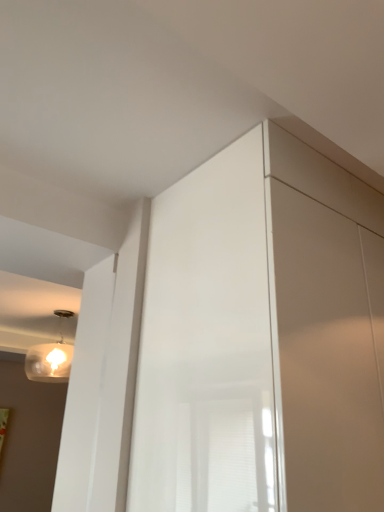
What do you see at coordinates (51, 357) in the screenshot? I see `matte glass lamp at upper left` at bounding box center [51, 357].

This screenshot has height=512, width=384. I want to click on matte glass lamp at upper left, so click(51, 357).

This screenshot has height=512, width=384. What do you see at coordinates (208, 347) in the screenshot? I see `glossy white screen door at center` at bounding box center [208, 347].

In order to click on glossy white screen door at center in this screenshot , I will do `click(208, 347)`.

Identify the location of matte glass lamp at upper left. Image resolution: width=384 pixels, height=512 pixels. (51, 357).

Considering the positions of objects glossy white screen door at center and matte glass lamp at upper left in the image provided, who is more to the right, glossy white screen door at center or matte glass lamp at upper left?

glossy white screen door at center.

Which object is closer to the camera taking this photo, glossy white screen door at center or matte glass lamp at upper left?

Positioned in front is glossy white screen door at center.

Is point (271, 468) closer or farther from the camera than point (50, 357)?

Point (271, 468) is positioned closer to the camera compared to point (50, 357).

From the image's perspective, between glossy white screen door at center and matte glass lamp at upper left, which one is located above?

glossy white screen door at center is shown above in the image.

Consider the image. From a real-world perspective, is glossy white screen door at center over matte glass lamp at upper left?

No, from a real-world perspective, glossy white screen door at center is not above matte glass lamp at upper left.

Is glossy white screen door at center wider than matte glass lamp at upper left?

Yes.

Does glossy white screen door at center have a lesser height compared to matte glass lamp at upper left?

No.

Looking at the image, does glossy white screen door at center seem bigger or smaller compared to matte glass lamp at upper left?

Considering their sizes, glossy white screen door at center takes up more space than matte glass lamp at upper left.

Is matte glass lamp at upper left surrounded by glossy white screen door at center?

No.

Is the surface of glossy white screen door at center in direct contact with matte glass lamp at upper left?

glossy white screen door at center is not next to matte glass lamp at upper left, and they're not touching.

Is glossy white screen door at center looking in the opposite direction of matte glass lamp at upper left?

Yes, glossy white screen door at center's orientation is away from matte glass lamp at upper left.

How far apart are glossy white screen door at center and matte glass lamp at upper left?

glossy white screen door at center and matte glass lamp at upper left are 7.44 feet apart from each other.

This screenshot has height=512, width=384. Find the location of `screen door lying in front of the matte glass lamp at upper left`. screen door lying in front of the matte glass lamp at upper left is located at coordinates (208, 347).

In the image, is matte glass lamp at upper left on the left side or the right side of glossy white screen door at center?

Clearly, matte glass lamp at upper left is on the left of glossy white screen door at center in the image.

Which object is closer to the camera taking this photo, matte glass lamp at upper left or glossy white screen door at center?

glossy white screen door at center.

Which point is more forward, (x=61, y=343) or (x=139, y=395)?

Positioned in front is point (x=139, y=395).

From the image's perspective, does matte glass lamp at upper left appear higher than glossy white screen door at center?

No, from the image's perspective, matte glass lamp at upper left is not above glossy white screen door at center.

From the picture: From a real-world perspective, is matte glass lamp at upper left positioned under glossy white screen door at center based on gravity?

Incorrect, from a real-world perspective, matte glass lamp at upper left is higher than glossy white screen door at center.

Which object is wider, matte glass lamp at upper left or glossy white screen door at center?

Wider between the two is glossy white screen door at center.

Who is taller, matte glass lamp at upper left or glossy white screen door at center?

Standing taller between the two is glossy white screen door at center.

Is matte glass lamp at upper left smaller than glossy white screen door at center?

Indeed, matte glass lamp at upper left has a smaller size compared to glossy white screen door at center.

From the picture: Which is correct: matte glass lamp at upper left is inside glossy white screen door at center, or outside of it?

matte glass lamp at upper left exists outside the volume of glossy white screen door at center.

From the picture: Is matte glass lamp at upper left directly adjacent to glossy white screen door at center?

No, matte glass lamp at upper left is not beside glossy white screen door at center.

Is glossy white screen door at center at the back of matte glass lamp at upper left?

Yes, matte glass lamp at upper left is facing away from glossy white screen door at center.

In the scene shown: How many degrees apart are the facing directions of matte glass lamp at upper left and glossy white screen door at center?

The angle between the facing direction of matte glass lamp at upper left and the facing direction of glossy white screen door at center is 172 degrees.

Locate an element on the screen. screen door that is under the matte glass lamp at upper left (from a real-world perspective) is located at coordinates (208, 347).

The image size is (384, 512). I want to click on lamp above the glossy white screen door at center (from a real-world perspective), so (x=51, y=357).

This screenshot has height=512, width=384. Identify the location of lamp on the left of glossy white screen door at center. (51, 357).